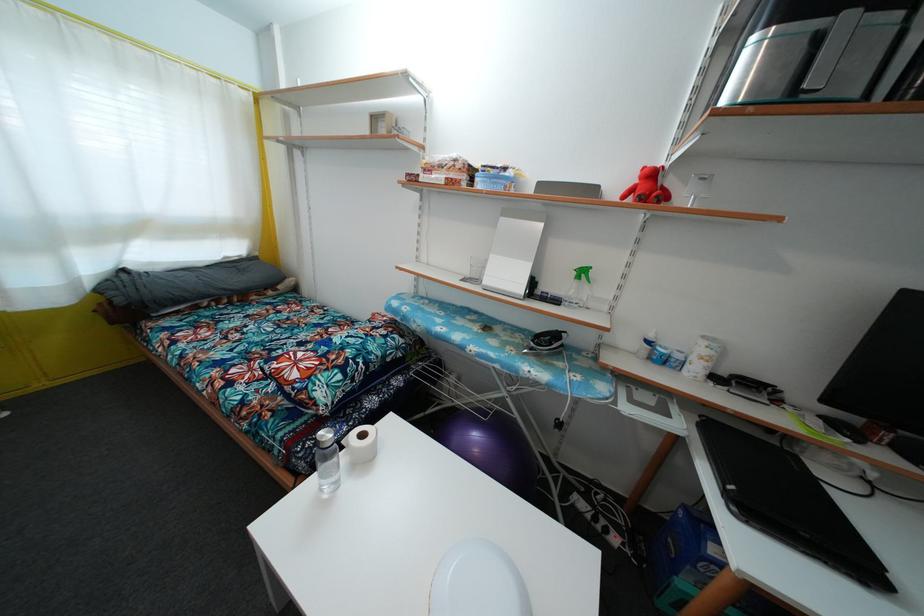
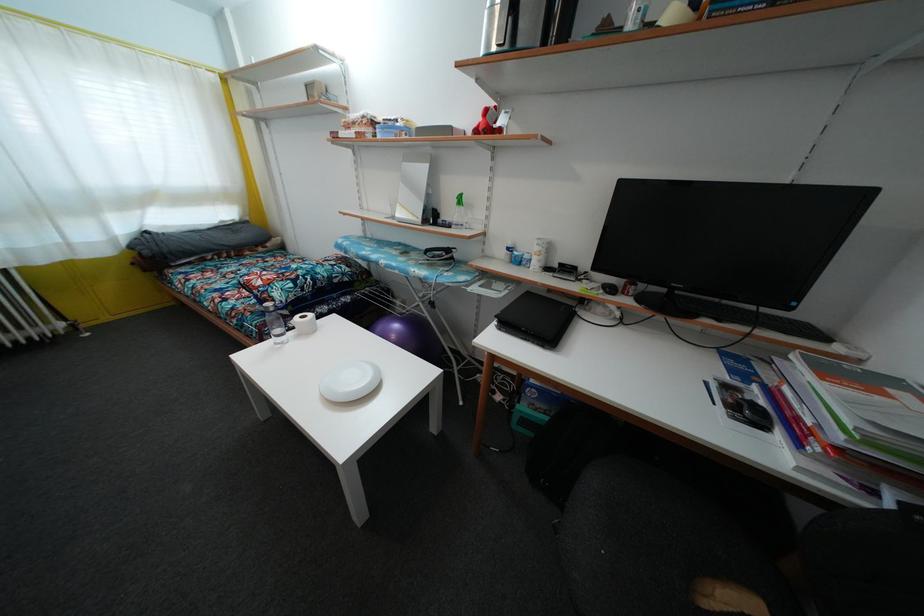
Where in the second image is the point corresponding to point (367, 442) from the first image?

(307, 323)